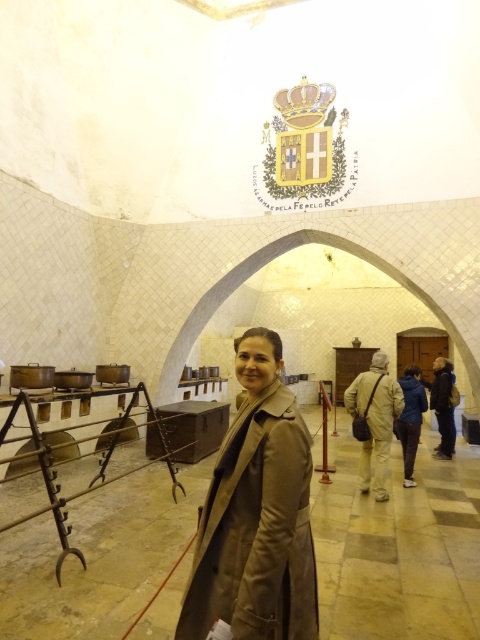
You are standing in the historical interior space and see the tan leather coat at center and the blue fabric jacket at center. Which one is nearer to you?

The tan leather coat at center is closer to the viewer than the blue fabric jacket at center.

You are a guest in this historical space and notice two items at the center of the room. Which item is positioned lower down between the tan leather coat at center and the khaki fabric pants at center?

The tan leather coat at center is located below the khaki fabric pants at center, so it is positioned lower down.